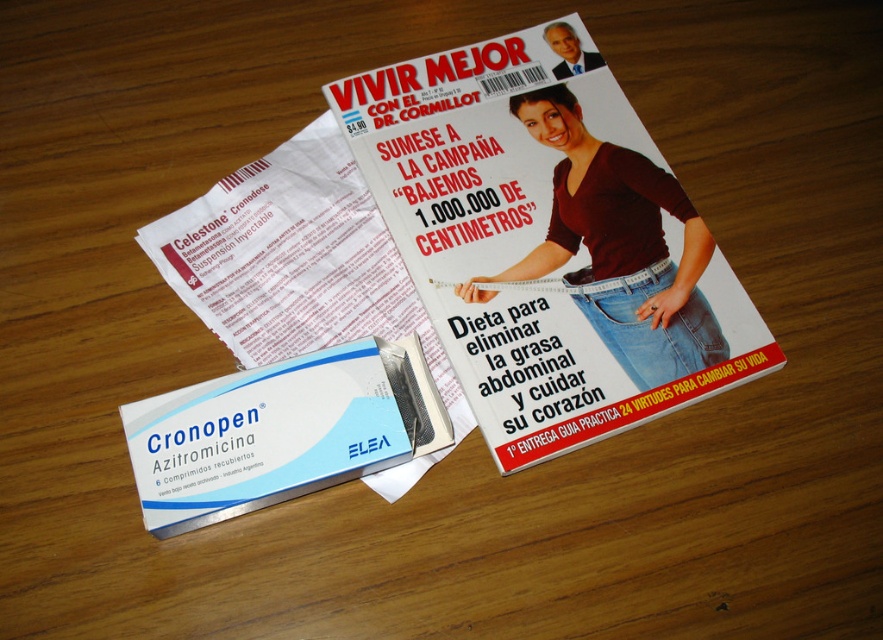
You are standing in front of a wooden table with two points marked on it. The points are labeled as point 1 at position (681,371) and point 2 at position (680,209). Based on their positions, which point is closer to you?

Point 1 at position (681,371) is closer to the viewer than point 2 at position (680,209).

You are a delivery person who needs to place a package on the wooden surface. The package is 10 inches long. You see the white paper at center and the jeans at center. Can the package fit between them without overlapping either?

The white paper at center and jeans at center are 9.33 inches apart. Since the package is 10 inches long, it cannot fit between them without overlapping either.